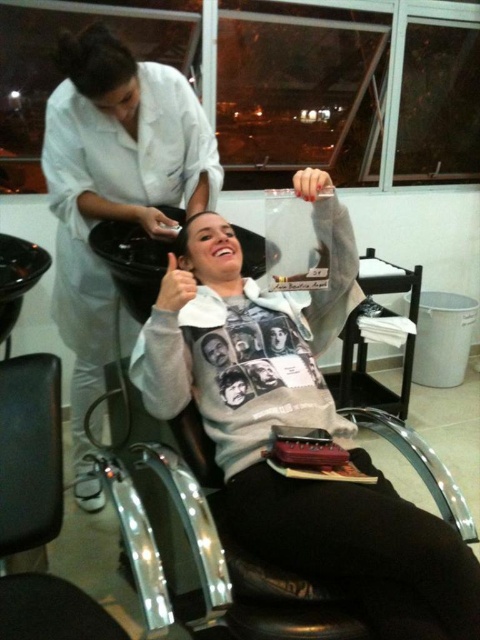
Question: Does white matte sweatshirt at center appear on the left side of white matte hairdresser at upper left?

Choices:
 (A) yes
 (B) no

Answer: (B)

Question: Does white matte sweatshirt at center have a greater width compared to white matte hairdresser at upper left?

Choices:
 (A) no
 (B) yes

Answer: (B)

Question: Considering the relative positions of white matte sweatshirt at center and white matte hairdresser at upper left in the image provided, where is white matte sweatshirt at center located with respect to white matte hairdresser at upper left?

Choices:
 (A) left
 (B) right

Answer: (B)

Question: Among these points, which one is farthest from the camera?

Choices:
 (A) (373, 509)
 (B) (153, 148)

Answer: (B)